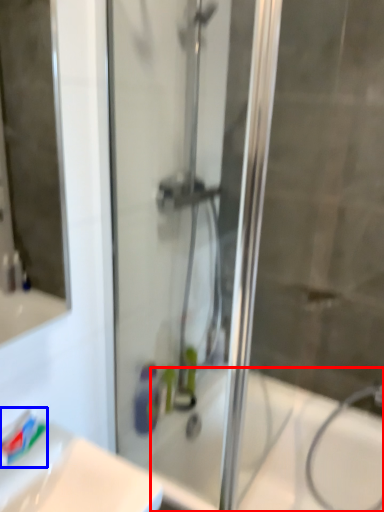
Question: Which object appears closest to the camera in this image, bath (highlighted by a red box) or toothpaste (highlighted by a blue box)?

Choices:
 (A) bath
 (B) toothpaste

Answer: (B)